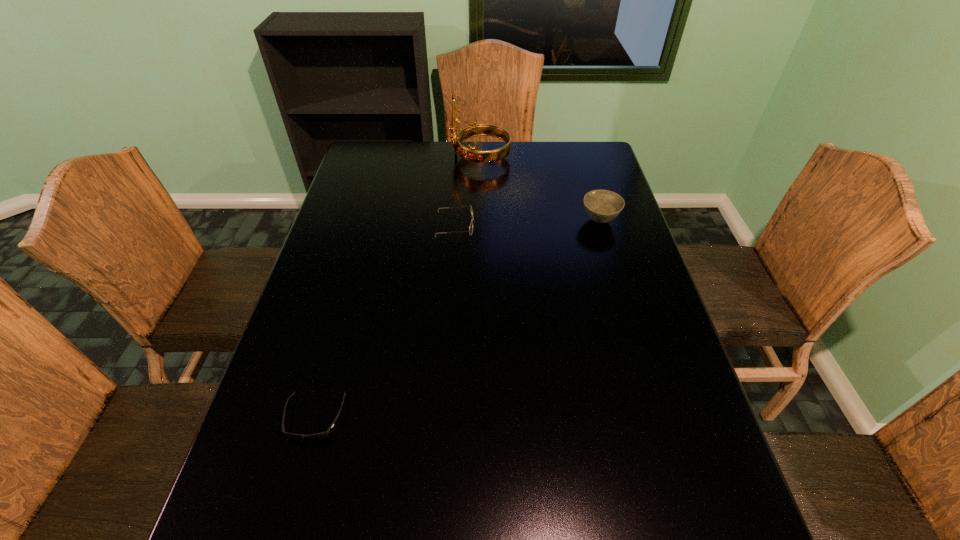
This screenshot has height=540, width=960. Identify the location of free space that satisfies the following two spatial constraints: 1. on the front-facing side of the third tallest object; 2. on the front-facing side of the shortest object. (444, 417).